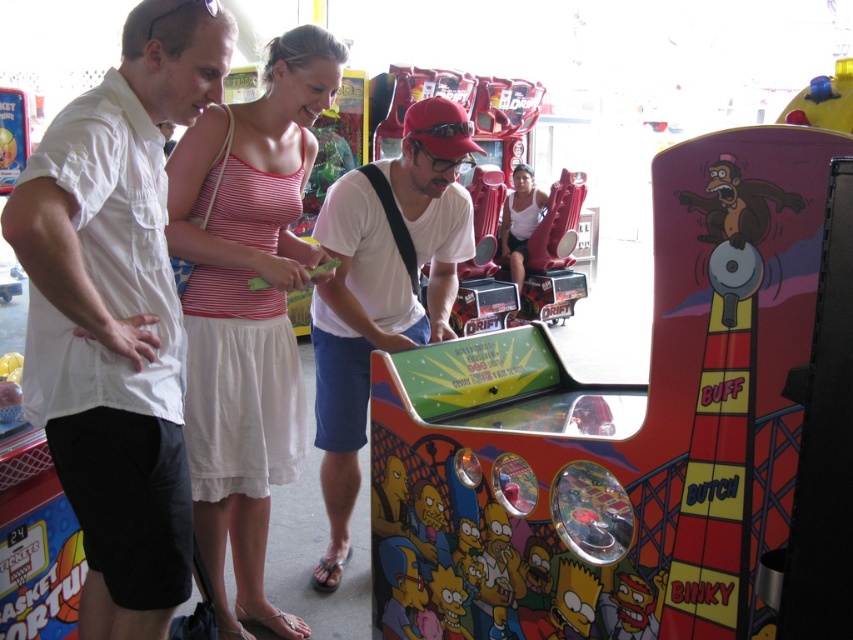
You are a customer in the arcade and want to choose between the white cotton dress at center and the white matte shirt at center displayed on the arcade machine. Which one is positioned higher?

The white cotton dress at center is above the white matte shirt at center, so the white cotton dress at center is positioned higher.

You are a game developer designing a new game. You want to place a new character sprite at the same position as the white cotton shirt at upper left. What coordinates should you use?

The coordinates for the white cotton shirt at upper left are at point (x=117, y=312), so you should place the new character sprite at those coordinates.

You are a photographer trying to capture a photo of both the white cotton shirt at upper left and the white matte shirt at center. Since you can only focus on one shirt at a time, which shirt should you focus on to ensure the other is still in the frame?

You should focus on the white matte shirt at center because the white cotton shirt at upper left is to the left of it, so keeping the center shirt in focus will naturally include the left shirt in the frame as well.